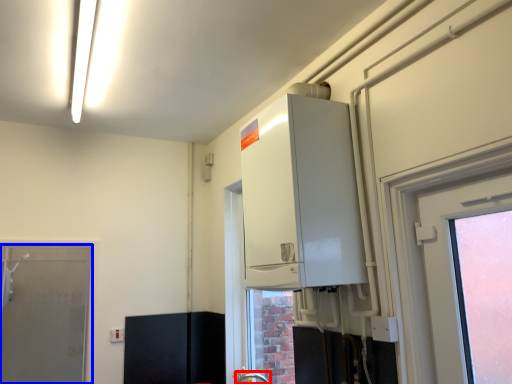
Question: Which point is further to the camera, faucet (highlighted by a red box) or door (highlighted by a blue box)?

Choices:
 (A) faucet
 (B) door

Answer: (B)